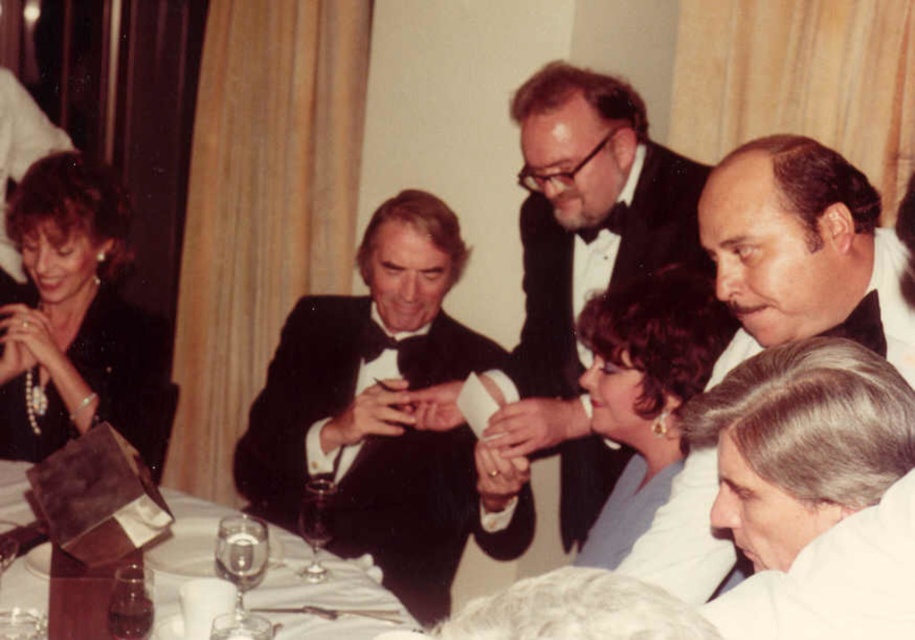
Who is shorter, black satin bow tie at upper right or white fabric at lower right?

With less height is white fabric at lower right.

Is black satin bow tie at upper right shorter than white fabric at lower right?

No.

The image size is (915, 640). I want to click on black satin bow tie at upper right, so click(803, 252).

At what (x,y) coordinates should I click in order to perform the action: click on black satin bow tie at upper right. Please return your answer as a coordinate pair (x, y). The width and height of the screenshot is (915, 640). Looking at the image, I should click on (803, 252).

Can you confirm if white fabric at lower right is wider than dark brown hair at upper center?

No.

Which of these two, white fabric at lower right or dark brown hair at upper center, stands taller?

Standing taller between the two is dark brown hair at upper center.

Image resolution: width=915 pixels, height=640 pixels. Describe the element at coordinates (802, 444) in the screenshot. I see `white fabric at lower right` at that location.

Locate an element on the screen. The height and width of the screenshot is (640, 915). white fabric at lower right is located at coordinates (802, 444).

Is point (450, 497) behind point (41, 595)?

Yes, it is.

Can you confirm if black satin tuxedo at center is smaller than white porcelain plate at center?

No.

Between point (293, 508) and point (2, 504), which one is positioned in front?

Point (2, 504) is more forward.

Where is `black satin tuxedo at center`? black satin tuxedo at center is located at coordinates (381, 413).